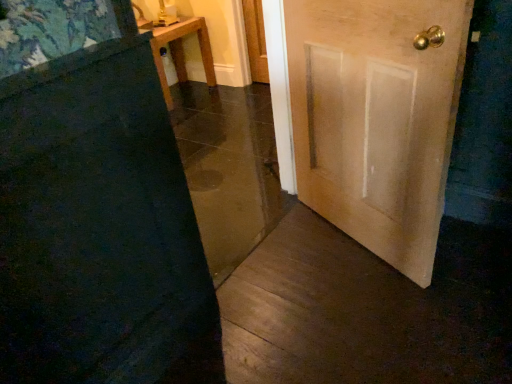
Question: Is wooden door at center, the 1th door in the left-to-right sequence, directly adjacent to light brown wooden door at right, which is the 1th door in right-to-left order?

Choices:
 (A) yes
 (B) no

Answer: (B)

Question: Does wooden door at center, the 1th door in the left-to-right sequence, appear on the left side of light brown wooden door at right, the second door viewed from the left?

Choices:
 (A) no
 (B) yes

Answer: (B)

Question: Is wooden door at center, the 1th door in the left-to-right sequence, taller than light brown wooden door at right, the second door viewed from the left?

Choices:
 (A) yes
 (B) no

Answer: (A)

Question: Is wooden door at center, marked as the 2th door in a right-to-left arrangement, outside of light brown wooden door at right, which is the 1th door in right-to-left order?

Choices:
 (A) yes
 (B) no

Answer: (A)

Question: From a real-world perspective, is wooden door at center, marked as the 2th door in a right-to-left arrangement, physically above light brown wooden door at right, the second door viewed from the left?

Choices:
 (A) no
 (B) yes

Answer: (B)

Question: Do you think light brown wooden door at right, the second door viewed from the left, is within wooden table at upper left, or outside of it?

Choices:
 (A) inside
 (B) outside

Answer: (B)

Question: From the image's perspective, relative to wooden table at upper left, is light brown wooden door at right, which is the 1th door in right-to-left order, above or below?

Choices:
 (A) below
 (B) above

Answer: (A)

Question: Visually, is light brown wooden door at right, which is the 1th door in right-to-left order, positioned to the left or to the right of wooden table at upper left?

Choices:
 (A) left
 (B) right

Answer: (B)

Question: Looking at their shapes, would you say light brown wooden door at right, which is the 1th door in right-to-left order, is wider or thinner than wooden table at upper left?

Choices:
 (A) thin
 (B) wide

Answer: (A)

Question: From a real-world perspective, is wooden door at center, the 1th door in the left-to-right sequence, above or below light brown wooden door at right, which is the 1th door in right-to-left order?

Choices:
 (A) below
 (B) above

Answer: (B)

Question: Is wooden door at center, the 1th door in the left-to-right sequence, taller or shorter than light brown wooden door at right, which is the 1th door in right-to-left order?

Choices:
 (A) tall
 (B) short

Answer: (A)

Question: In the image, is wooden door at center, marked as the 2th door in a right-to-left arrangement, positioned in front of or behind light brown wooden door at right, the second door viewed from the left?

Choices:
 (A) front
 (B) behind

Answer: (A)

Question: Is point (65, 203) closer or farther from the camera than point (433, 160)?

Choices:
 (A) closer
 (B) farther

Answer: (A)

Question: Considering the positions of wooden table at upper left and wooden door at center, marked as the 2th door in a right-to-left arrangement, in the image, is wooden table at upper left wider or thinner than wooden door at center, marked as the 2th door in a right-to-left arrangement,?

Choices:
 (A) thin
 (B) wide

Answer: (B)

Question: From a real-world perspective, is wooden table at upper left positioned above or below wooden door at center, the 1th door in the left-to-right sequence?

Choices:
 (A) above
 (B) below

Answer: (B)